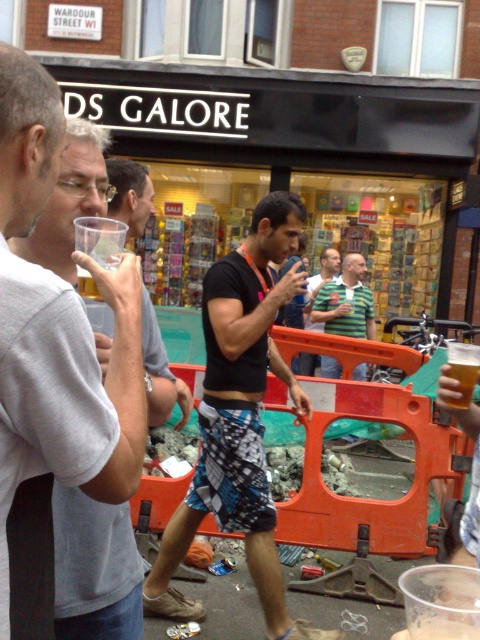
You are at the DS Galore shop and see a person wearing a black matte shirt at center and holding a translucent plastic cup at center. Which object is positioned more to the left?

The black matte shirt at center is positioned to the left of the translucent plastic cup at center.

You are at the DS Galore shop and want to pick up the clear plastic cup at center. Is the white matte cup at upper left blocking your path to it?

The white matte cup at upper left is in front of the clear plastic cup at center, so it is blocking the path to the clear plastic cup at center.